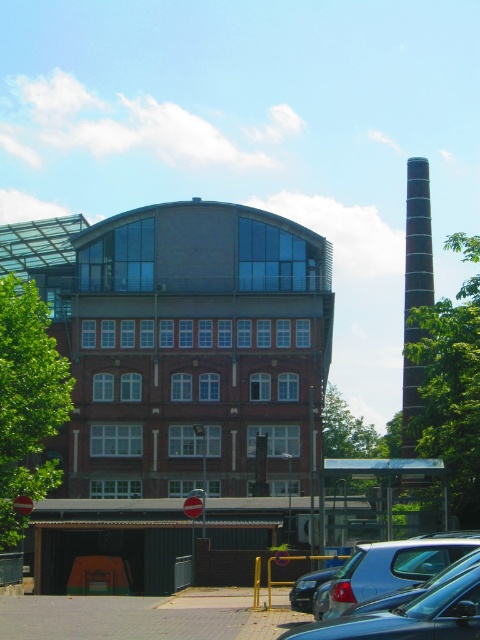
Consider the image. Is green leafy tree at right thinner than black textured chimney at right?

Indeed, green leafy tree at right has a lesser width compared to black textured chimney at right.

Image resolution: width=480 pixels, height=640 pixels. What do you see at coordinates (451, 394) in the screenshot? I see `green leafy tree at right` at bounding box center [451, 394].

Describe the element at coordinates (451, 394) in the screenshot. I see `green leafy tree at right` at that location.

I want to click on green leafy tree at right, so click(451, 394).

Is point (128, 323) positioned before point (301, 604)?

No, (128, 323) is further to viewer.

Is brown brick building at center to the left of shiny silver sedan at center from the viewer's perspective?

Yes, brown brick building at center is to the left of shiny silver sedan at center.

At what (x,y) coordinates should I click in order to perform the action: click on brown brick building at center. Please return your answer as a coordinate pair (x, y). Image resolution: width=480 pixels, height=640 pixels. Looking at the image, I should click on (183, 346).

The height and width of the screenshot is (640, 480). I want to click on brown brick building at center, so click(x=183, y=346).

Is point (223, 458) farther from viewer compared to point (0, 444)?

Yes, it is behind point (0, 444).

Is point (231, 371) in front of point (0, 413)?

No, (231, 371) is behind (0, 413).

What are the coordinates of `brown brick building at center` in the screenshot? It's located at (183, 346).